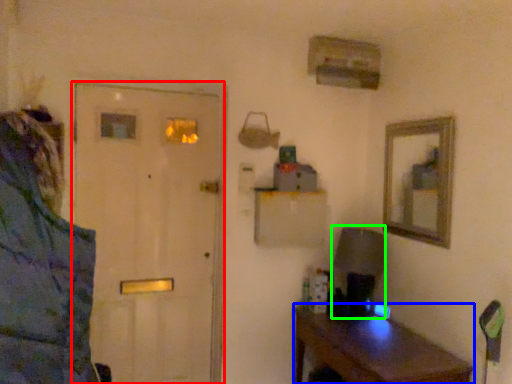
Question: Which object is positioned farthest from door (highlighted by a red box)? Select from desk (highlighted by a blue box) and table lamp (highlighted by a green box).

Choices:
 (A) desk
 (B) table lamp

Answer: (B)